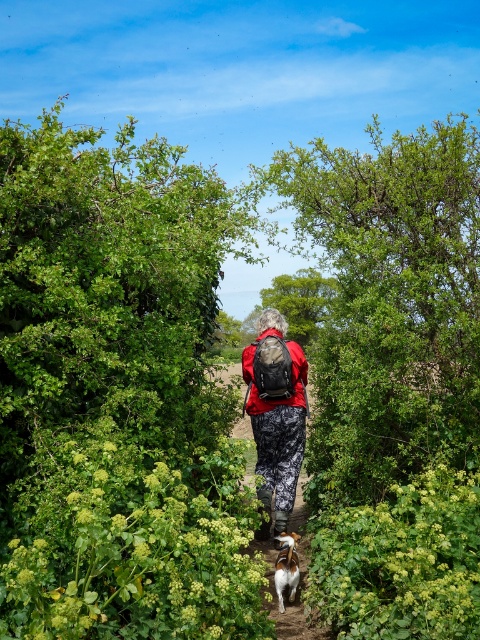
Does matte black backpack at center have a lesser width compared to camouflage-patterned pants at center?

Yes, matte black backpack at center is thinner than camouflage-patterned pants at center.

Does matte black backpack at center have a greater width compared to camouflage-patterned pants at center?

Incorrect, matte black backpack at center's width does not surpass camouflage-patterned pants at center's.

Is point (262, 353) in front of point (297, 509)?

Yes, point (262, 353) is in front of point (297, 509).

You are a GUI agent. You are given a task and a screenshot of the screen. Output one action in this format:
    pyautogui.click(x=<x>, y=<y>)
    Task: Click on the matte black backpack at center
    This screenshot has width=480, height=640.
    Given the screenshot: What is the action you would take?
    pyautogui.click(x=276, y=412)

From the picture: How distant is matte black backpack at center from white fur dog at center?

matte black backpack at center is 3.37 feet from white fur dog at center.

The height and width of the screenshot is (640, 480). Describe the element at coordinates (276, 412) in the screenshot. I see `matte black backpack at center` at that location.

Between point (289, 392) and point (294, 557), which one is positioned behind?

Point (289, 392)

The image size is (480, 640). What are the coordinates of `matte black backpack at center` in the screenshot? It's located at (276, 412).

Who is more distant from viewer, (298, 506) or (288, 563)?

Point (298, 506)

Between camouflage-patterned pants at center and white fur dog at center, which one has less height?

white fur dog at center

Describe the element at coordinates (294, 602) in the screenshot. The width and height of the screenshot is (480, 640). I see `camouflage-patterned pants at center` at that location.

You are a GUI agent. You are given a task and a screenshot of the screen. Output one action in this format:
    pyautogui.click(x=<x>, y=<y>)
    Task: Click on the camouflage-patterned pants at center
    The image size is (480, 640).
    Given the screenshot: What is the action you would take?
    pyautogui.click(x=294, y=602)